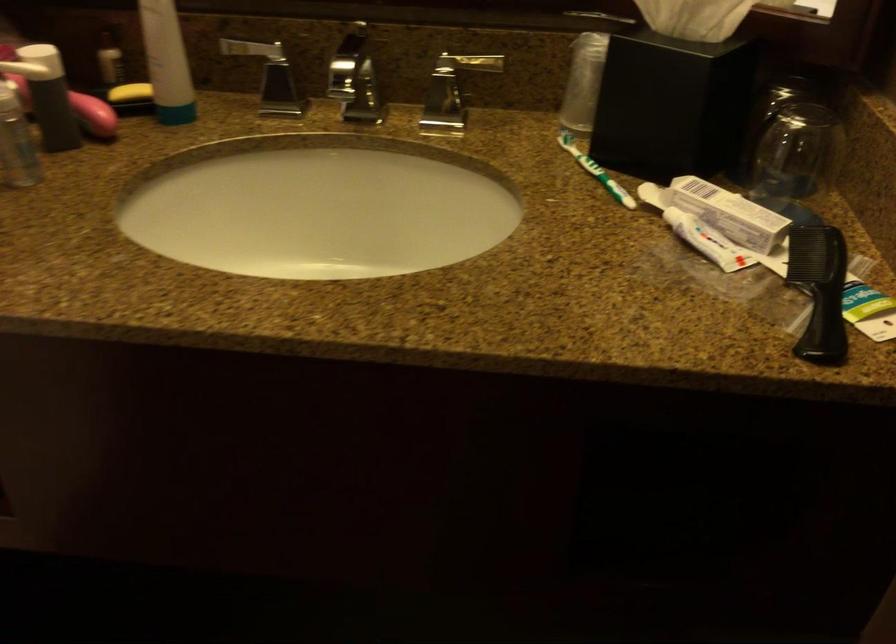
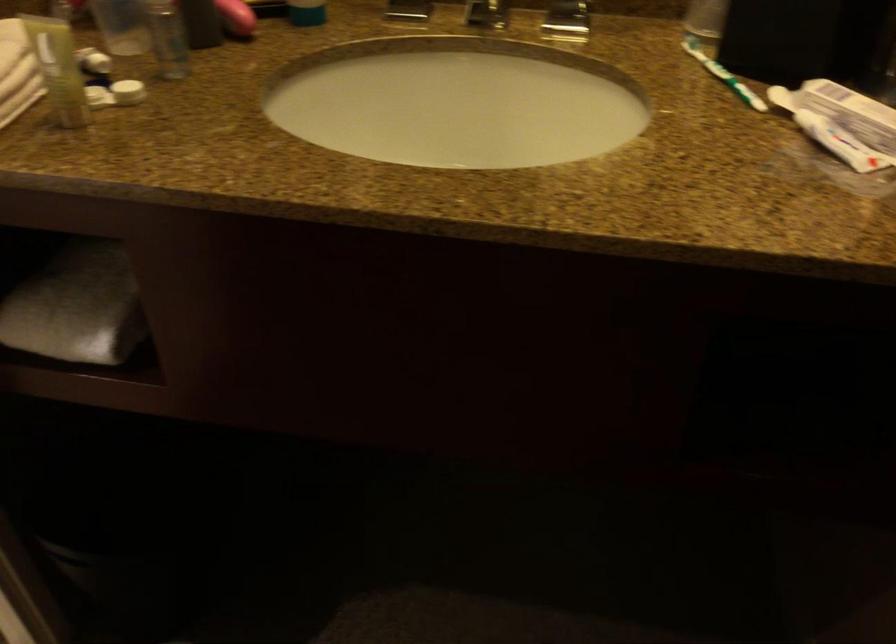
Find the pixel in the second image that matches point (595, 167) in the first image.

(722, 75)